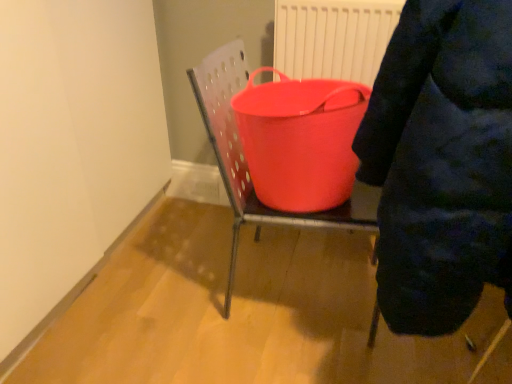
Question: Is rubberized plastic bucket at center facing away from rubberized red bucket at center?

Choices:
 (A) no
 (B) yes

Answer: (B)

Question: Is rubberized plastic bucket at center thinner than rubberized red bucket at center?

Choices:
 (A) yes
 (B) no

Answer: (B)

Question: Is rubberized plastic bucket at center further to camera compared to rubberized red bucket at center?

Choices:
 (A) no
 (B) yes

Answer: (A)

Question: Is rubberized plastic bucket at center to the right of rubberized red bucket at center from the viewer's perspective?

Choices:
 (A) no
 (B) yes

Answer: (B)

Question: Are rubberized plastic bucket at center and rubberized red bucket at center far apart?

Choices:
 (A) no
 (B) yes

Answer: (A)

Question: Would you say rubberized plastic bucket at center is inside or outside dark blue puffer jacket at upper right?

Choices:
 (A) outside
 (B) inside

Answer: (A)

Question: Is rubberized plastic bucket at center bigger or smaller than dark blue puffer jacket at upper right?

Choices:
 (A) big
 (B) small

Answer: (B)

Question: Is point (231, 251) closer or farther from the camera than point (403, 162)?

Choices:
 (A) farther
 (B) closer

Answer: (A)

Question: In terms of height, does rubberized plastic bucket at center look taller or shorter compared to dark blue puffer jacket at upper right?

Choices:
 (A) short
 (B) tall

Answer: (A)

Question: Is point (343, 175) closer or farther from the camera than point (230, 274)?

Choices:
 (A) farther
 (B) closer

Answer: (B)

Question: Is rubberized red bucket at center situated inside rubberized plastic bucket at center or outside?

Choices:
 (A) inside
 (B) outside

Answer: (A)

Question: From their relative heights in the image, would you say rubberized red bucket at center is taller or shorter than rubberized plastic bucket at center?

Choices:
 (A) short
 (B) tall

Answer: (A)

Question: From a real-world perspective, is rubberized red bucket at center above or below rubberized plastic bucket at center?

Choices:
 (A) below
 (B) above

Answer: (B)

Question: Do you think rubberized red bucket at center is within dark blue puffer jacket at upper right, or outside of it?

Choices:
 (A) outside
 (B) inside

Answer: (A)

Question: Looking at the image, does rubberized red bucket at center seem bigger or smaller compared to dark blue puffer jacket at upper right?

Choices:
 (A) small
 (B) big

Answer: (A)